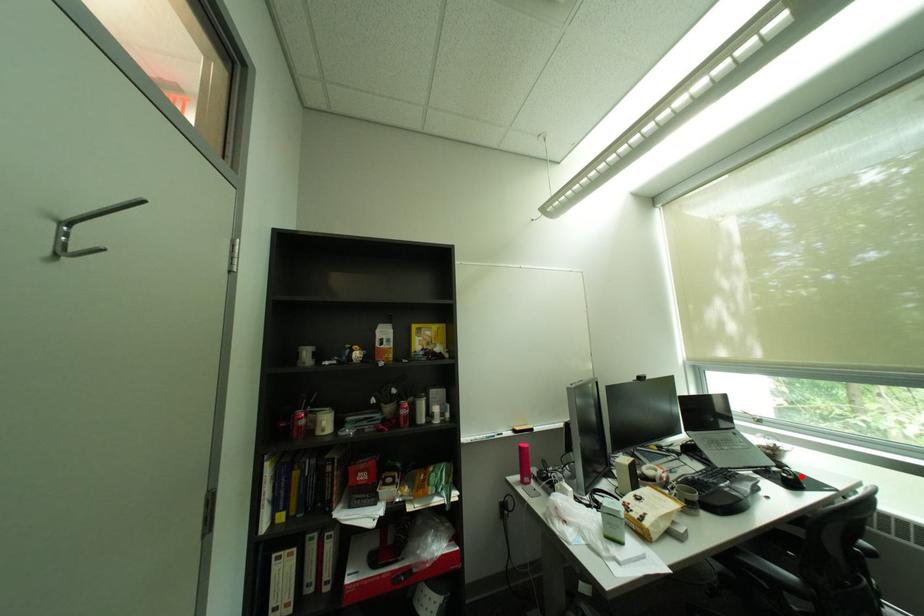
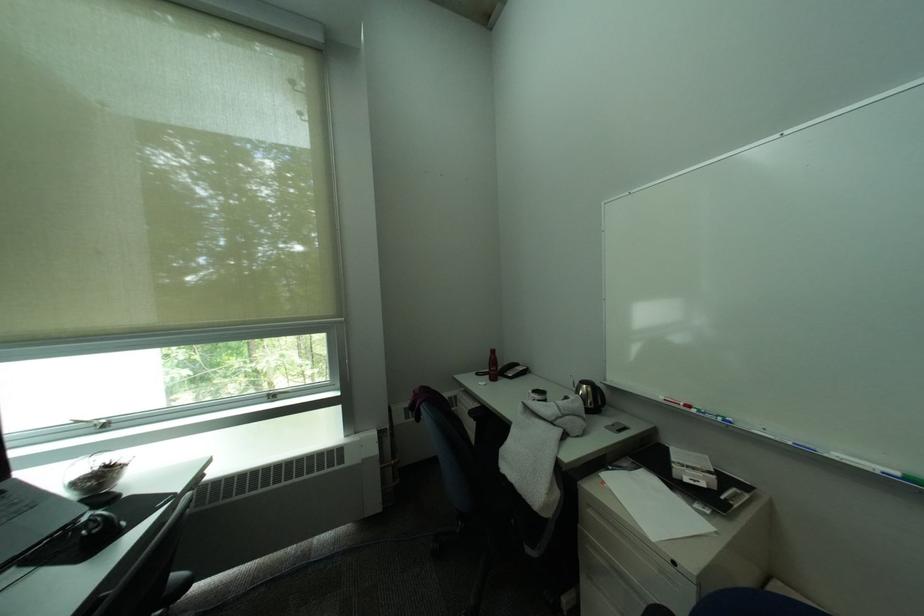
Find the pixel in the second image that matches the highlighted location in the first image.

(106, 528)